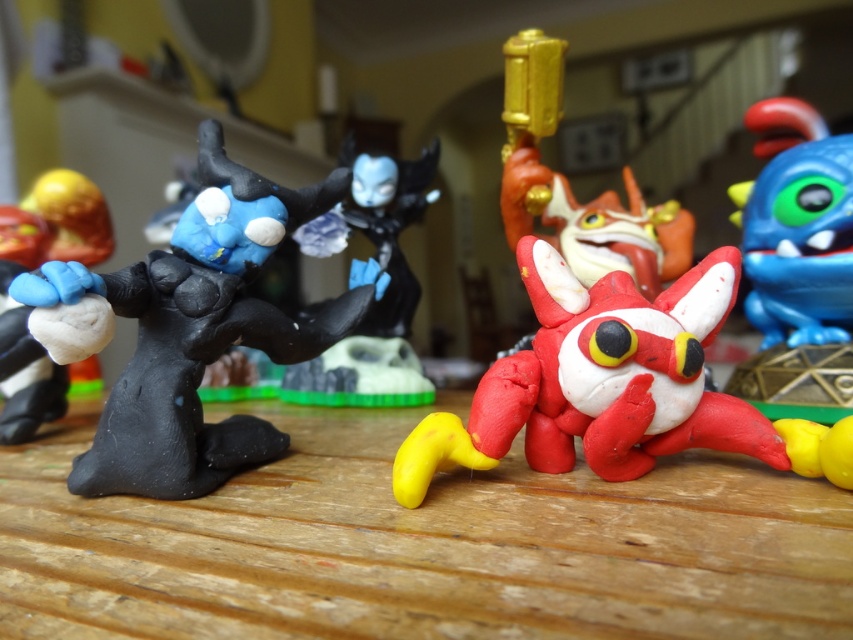
Can you confirm if rubberized red fox at center is thinner than matte black figure at left?

Incorrect, rubberized red fox at center's width is not less than matte black figure at left's.

Who is more distant from viewer, (766,444) or (90,220)?

The point (90,220) is more distant.

Identify the location of rubberized red fox at center. Image resolution: width=853 pixels, height=640 pixels. (598, 381).

Does black matte figure at left have a lesser width compared to blue rubber dragon at right?

No.

Who is higher up, black matte figure at left or blue rubber dragon at right?

blue rubber dragon at right is above.

Locate an element on the screen. Image resolution: width=853 pixels, height=640 pixels. black matte figure at left is located at coordinates (181, 330).

Image resolution: width=853 pixels, height=640 pixels. Find the location of `black matte figure at left`. black matte figure at left is located at coordinates (181, 330).

Which of these two, blue rubber dragon at right or matte black figure at left, stands taller?

Standing taller between the two is matte black figure at left.

Is blue rubber dragon at right closer to the viewer compared to matte black figure at left?

No.

Is point (764, 257) less distant than point (35, 401)?

No.

Locate an element on the screen. This screenshot has width=853, height=640. blue rubber dragon at right is located at coordinates (x=798, y=225).